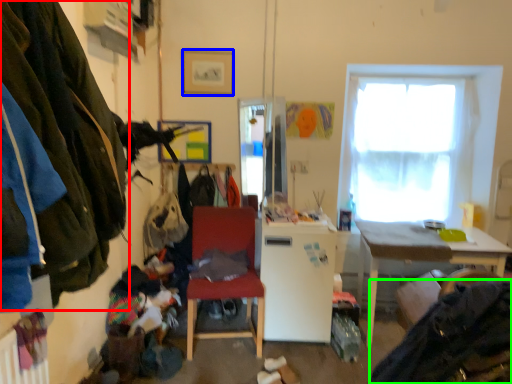
Question: Estimate the real-world distances between objects in this image. Which object is farther from clothing (highlighted by a red box), picture frame (highlighted by a blue box) or clothing (highlighted by a green box)?

Choices:
 (A) picture frame
 (B) clothing

Answer: (A)